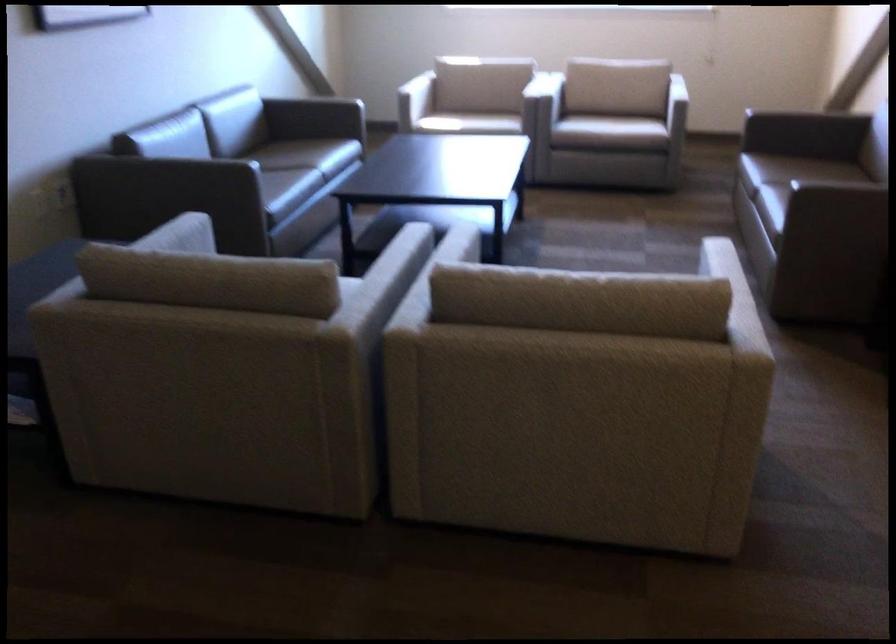
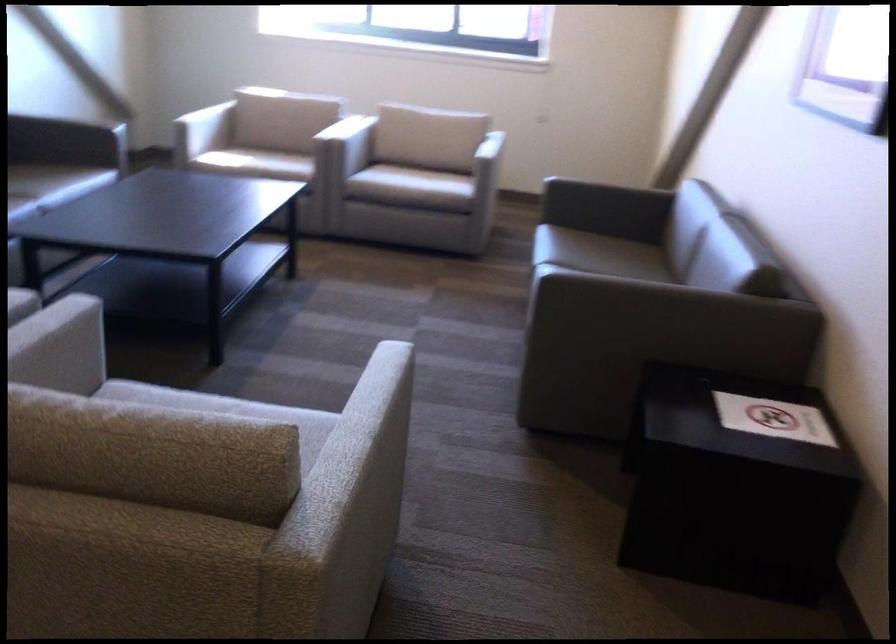
Which direction would the cameraman need to move to produce the second image?

The movement direction of the cameraman is right, forward.